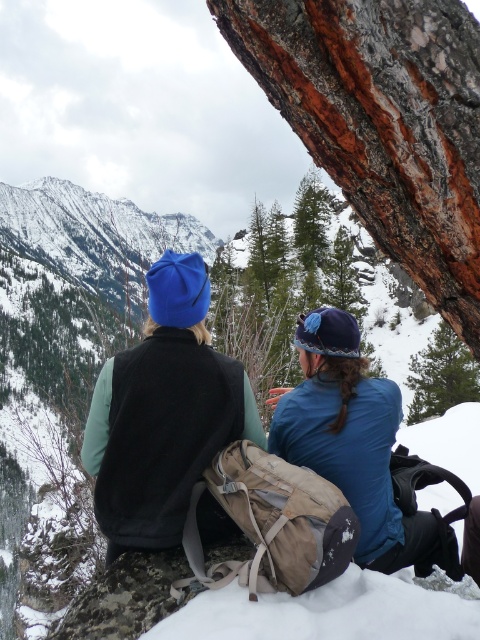
Which is above, matte blue beanie at upper left or blue fabric hat at upper center?

matte blue beanie at upper left

This screenshot has height=640, width=480. Describe the element at coordinates (164, 413) in the screenshot. I see `matte blue beanie at upper left` at that location.

Measure the distance between point (x=358, y=396) and camera.

Point (x=358, y=396) is 33.71 meters from camera.

At what (x,y) coordinates should I click in order to perform the action: click on matte blue beanie at upper left. Please return your answer as a coordinate pair (x, y). Looking at the image, I should click on (164, 413).

Between blue fabric hat at upper center and green textured pine tree at upper right, which one has less height?

With less height is green textured pine tree at upper right.

Who is more forward, (x=389, y=449) or (x=431, y=358)?

Point (x=389, y=449) is in front.

I want to click on blue fabric hat at upper center, so click(355, 444).

Is matte blue beanie at upper left smaller than green textured pine tree at upper right?

Incorrect, matte blue beanie at upper left is not smaller in size than green textured pine tree at upper right.

Is matte blue beanie at upper left in front of green textured pine tree at upper right?

Yes, matte blue beanie at upper left is in front of green textured pine tree at upper right.

Does point (135, 385) come behind point (475, 381)?

No, (135, 385) is in front of (475, 381).

Locate an element on the screen. The image size is (480, 640). matte blue beanie at upper left is located at coordinates (164, 413).